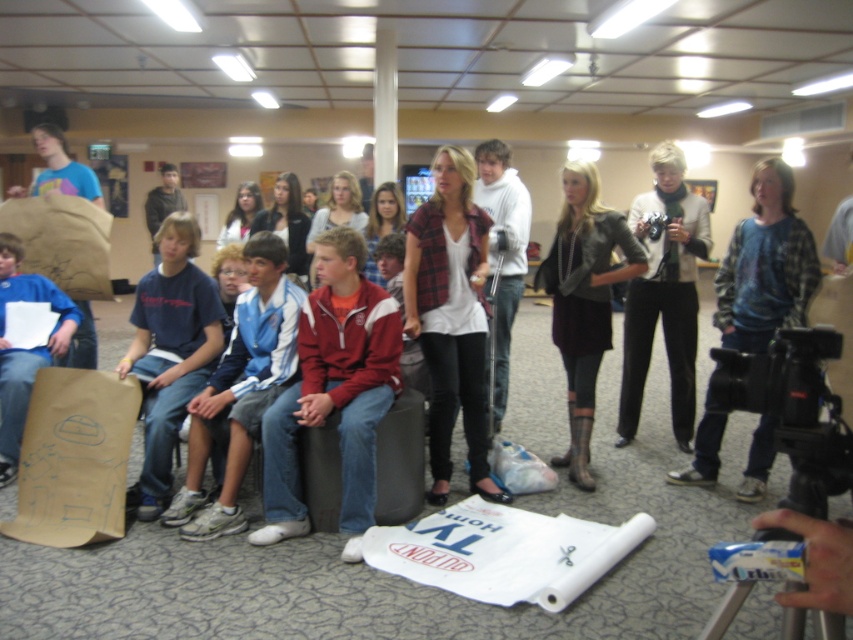
Question: Considering the real-world distances, which object is farthest from the black plastic video camera at lower right?

Choices:
 (A) dark gray sweater at center
 (B) leather jacket at center

Answer: (A)

Question: Does red jacket at center come behind dark gray sweater at center?

Choices:
 (A) yes
 (B) no

Answer: (B)

Question: Does red jacket at center have a smaller size compared to black plastic video camera at lower right?

Choices:
 (A) no
 (B) yes

Answer: (A)

Question: Among these objects, which one is farthest from the camera?

Choices:
 (A) blue athletic wear at center
 (B) plaid flannel shirt at center
 (C) black plastic video camera at lower right

Answer: (B)

Question: Among these objects, which one is nearest to the camera?

Choices:
 (A) dark gray sweater at center
 (B) red jacket at center
 (C) plaid flannel shirt at center
 (D) leather jacket at center

Answer: (B)

Question: Is dark gray sweater at center below black plastic video camera at lower right?

Choices:
 (A) yes
 (B) no

Answer: (B)